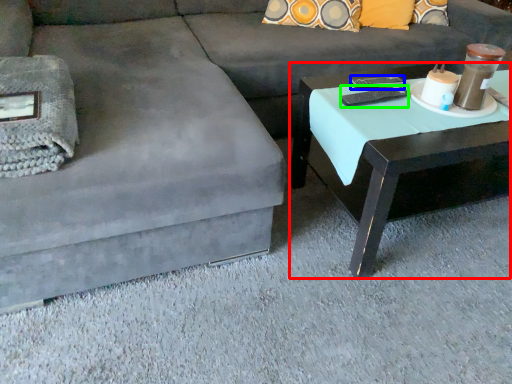
Question: Which object is the farthest from coffee table (highlighted by a red box)? Choose among these: remote (highlighted by a blue box) or remote (highlighted by a green box).

Choices:
 (A) remote
 (B) remote

Answer: (A)